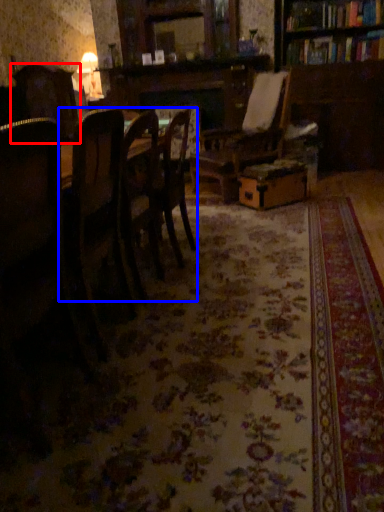
Question: Which object appears closest to the camera in this image, chair (highlighted by a red box) or kitchen & dining room table (highlighted by a blue box)?

Choices:
 (A) chair
 (B) kitchen & dining room table

Answer: (B)